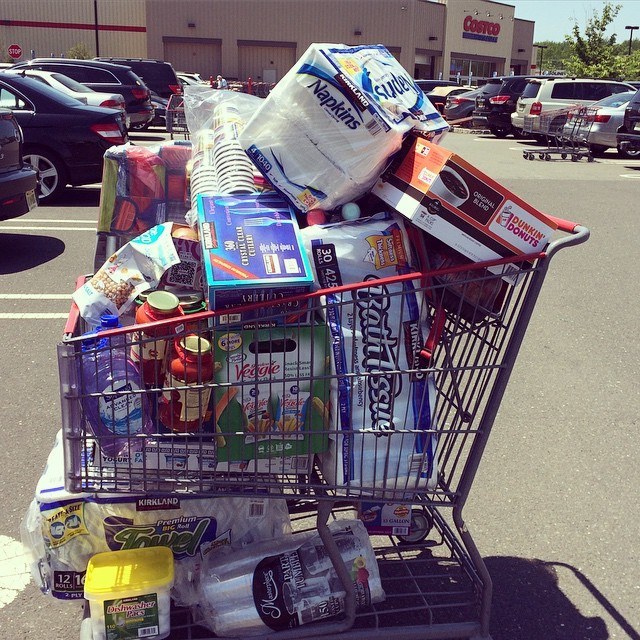
Where is `toilet paper`? toilet paper is located at coordinates (380, 342).